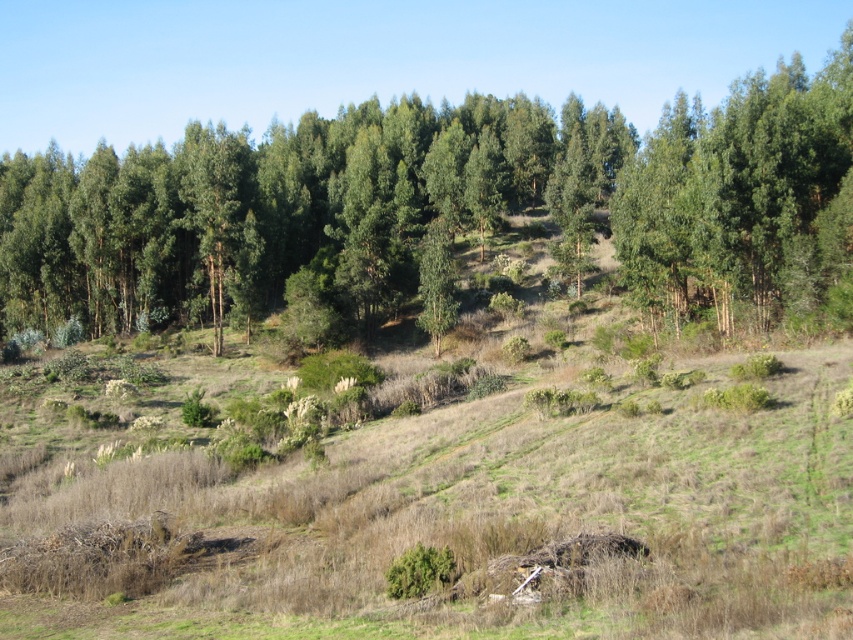
You are a GUI agent. You are given a task and a screenshot of the screen. Output one action in this format:
    pyautogui.click(x=<x>, y=<y>)
    Task: Click on the green leafy trees at center
    The image size is (853, 640).
    Given the screenshot: What is the action you would take?
    pyautogui.click(x=432, y=205)

Does green leafy trees at center have a greater width compared to green leafy tree at upper right?

Yes, green leafy trees at center is wider than green leafy tree at upper right.

Which is behind, point (428, 131) or point (718, 300)?

The point (428, 131) is behind.

Identify the location of green leafy trees at center. This screenshot has width=853, height=640. (432, 205).